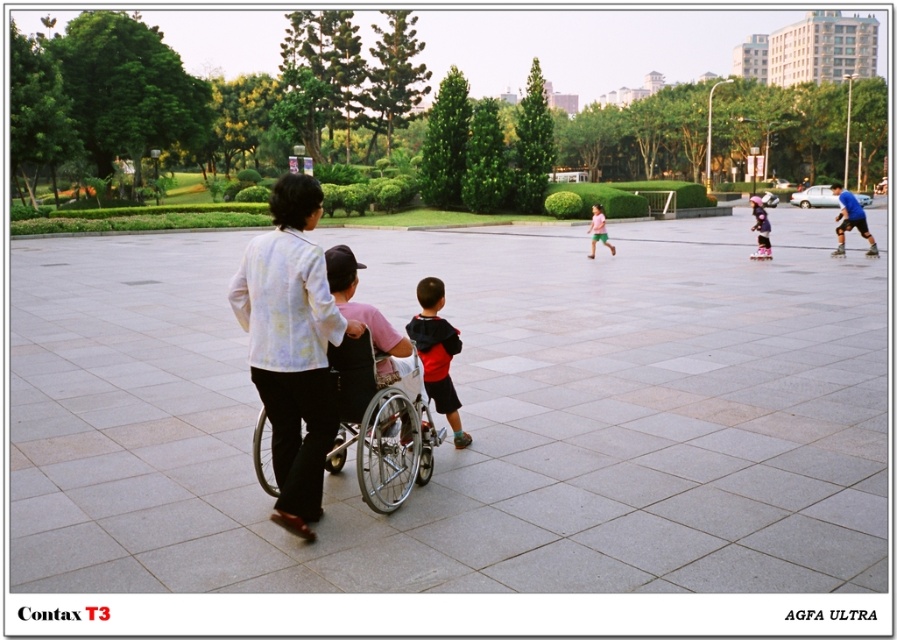
You are a photographer standing in the plaza and see the matte black shirt at center and the red hoodie at center. Which one is higher up in the image?

The matte black shirt at center is above the red hoodie at center in the image.

You are a maintenance worker in the park and you need to move the silver metallic wheelchair at center and the pink rubber roller skate at center to the storage room. Which object requires more vertical space in the storage room?

The silver metallic wheelchair at center requires more vertical space in the storage room because it is much taller than the pink rubber roller skate at center.

You are standing at the camera position and want to walk towards the two points in the scene. Which point, point [405,413] or point [763,246], will you reach first?

You will reach point [405,413] first because it is closer to the viewer than point [763,246].